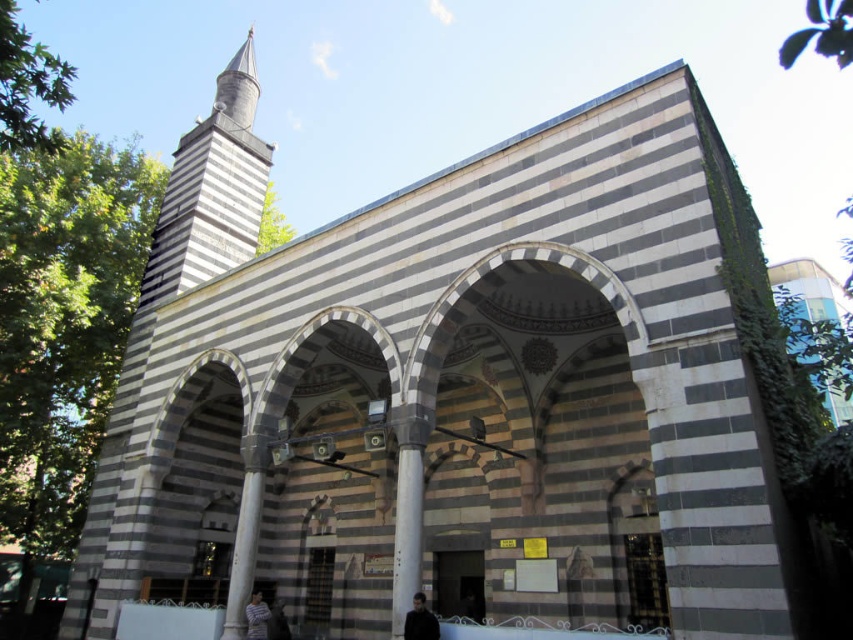
Question: From the image, what is the correct spatial relationship of gray stone minaret at upper left in relation to striped shirt at lower center?

Choices:
 (A) left
 (B) right

Answer: (A)

Question: Which object appears farthest from the camera in this image?

Choices:
 (A) gray stone minaret at upper left
 (B) striped shirt at lower center

Answer: (A)

Question: Does gray stone minaret at upper left have a larger size compared to striped shirt at lower center?

Choices:
 (A) yes
 (B) no

Answer: (A)

Question: Where is gray stone minaret at upper left located in relation to dark brown leather jacket at lower right in the image?

Choices:
 (A) below
 (B) above

Answer: (B)

Question: Which is farther from the striped shirt at lower center?

Choices:
 (A) dark brown leather jacket at lower right
 (B) gray stone minaret at upper left

Answer: (B)

Question: Which point is closer to the camera?

Choices:
 (A) (239, 49)
 (B) (259, 636)
 (C) (413, 605)

Answer: (C)